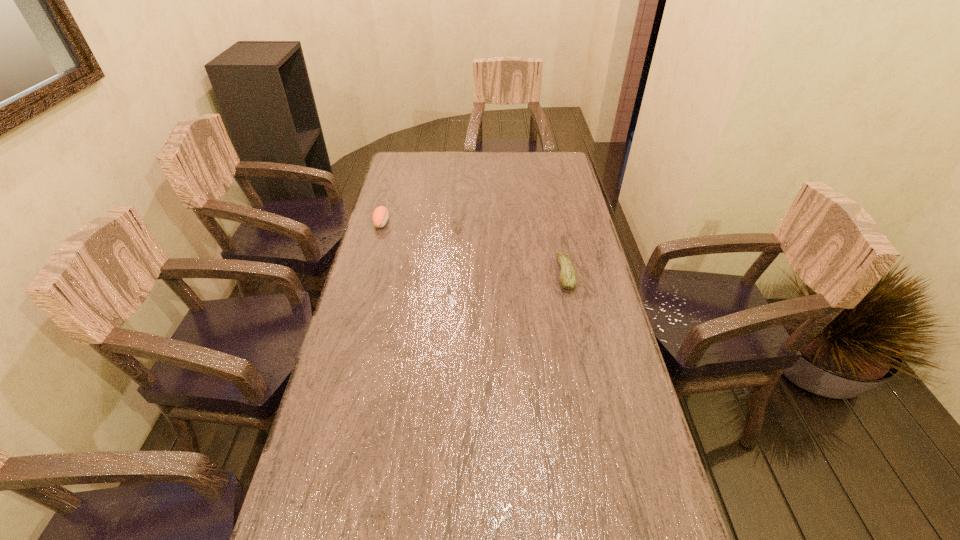
Find the location of a particular element. This screenshot has width=960, height=540. the leftmost object is located at coordinates (380, 216).

Locate an element on the screen. the farther sushi is located at coordinates (380, 216).

Where is `the second farthest object`? The height and width of the screenshot is (540, 960). the second farthest object is located at coordinates (568, 279).

The width and height of the screenshot is (960, 540). In order to click on the rightmost object in this screenshot , I will do `click(568, 279)`.

Where is `vacant area located 0.400m on the back of the farthest object`? The height and width of the screenshot is (540, 960). vacant area located 0.400m on the back of the farthest object is located at coordinates (398, 161).

The image size is (960, 540). I want to click on vacant space located at the stem end of the rightmost object, so click(x=498, y=274).

At what (x,y) coordinates should I click in order to perform the action: click on free location located at the stem end of the rightmost object. Please return your answer as a coordinate pair (x, y). The height and width of the screenshot is (540, 960). Looking at the image, I should click on (443, 274).

The width and height of the screenshot is (960, 540). Find the location of `free space located at the stem end of the rightmost object`. free space located at the stem end of the rightmost object is located at coordinates (489, 274).

Find the location of a particular element. This screenshot has width=960, height=540. object that is positioned at the left edge is located at coordinates (380, 216).

Where is `object at the right edge`? object at the right edge is located at coordinates (568, 279).